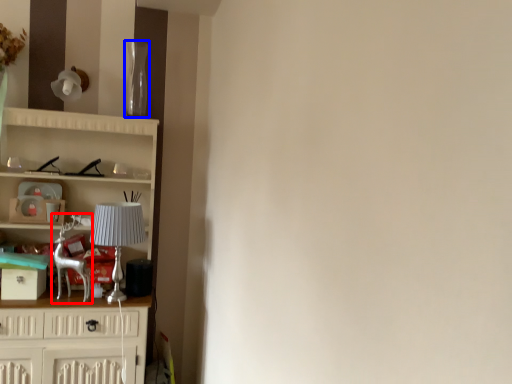
Question: Among these objects, which one is nearest to the camera, swivel chair (highlighted by a red box) or glass vase (highlighted by a blue box)?

Choices:
 (A) swivel chair
 (B) glass vase

Answer: (A)